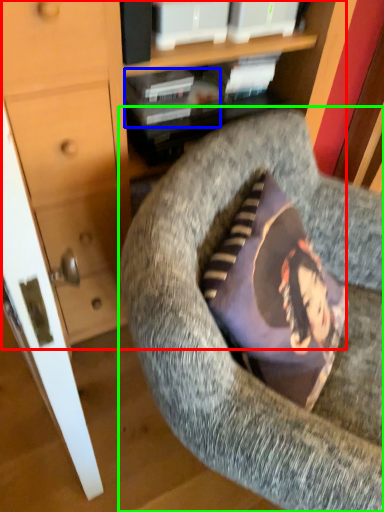
Question: Based on their relative distances, which object is farther from dresser (highlighted by a red box)? Choose from book (highlighted by a blue box) and chair (highlighted by a green box).

Choices:
 (A) book
 (B) chair

Answer: (B)